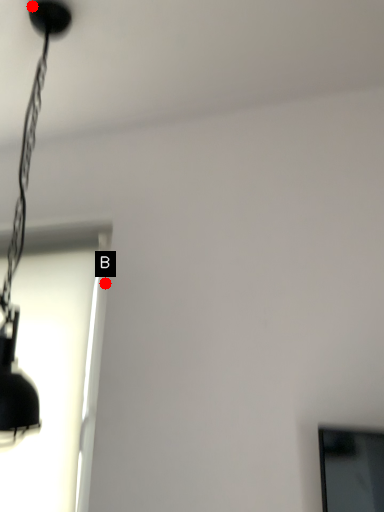
Question: Two points are circled on the image, labeled by A and B beside each circle. Which point is closer to the camera?

Choices:
 (A) A is closer
 (B) B is closer

Answer: (A)